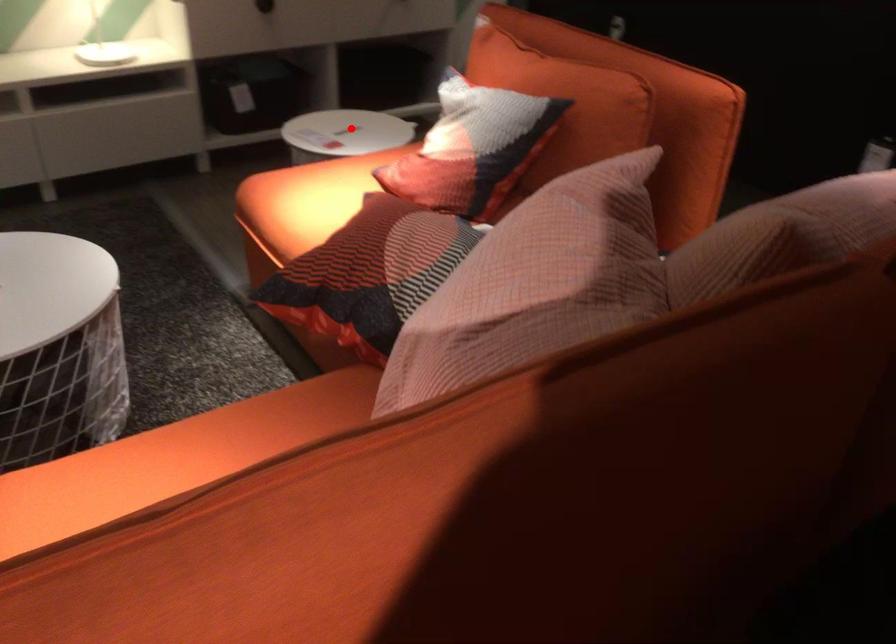
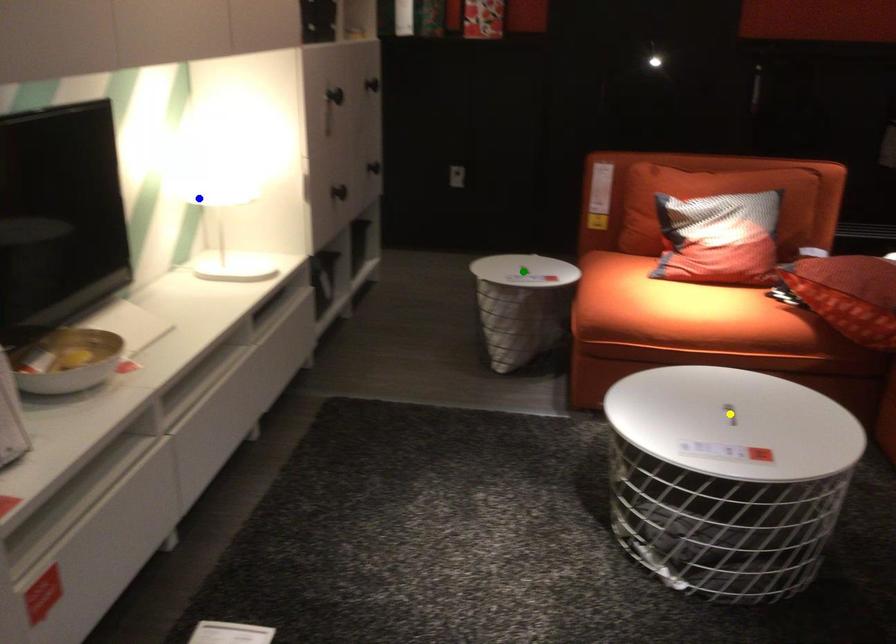
Question: I am providing you with two images of the same scene from different viewpoints. A red point is marked on the first image. You are given multiple points on the second image. Which point in image 2 is actually the same real-world point as the red point in image 1?

Choices:
 (A) blue point
 (B) green point
 (C) yellow point

Answer: (B)